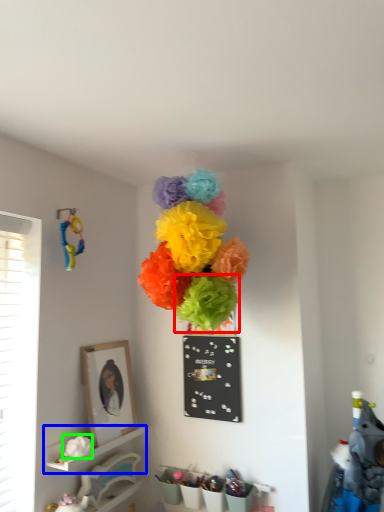
Question: Which object is the farthest from flower (highlighted by a red box)? Choose among these: shelf (highlighted by a blue box) or flower (highlighted by a green box).

Choices:
 (A) shelf
 (B) flower

Answer: (A)